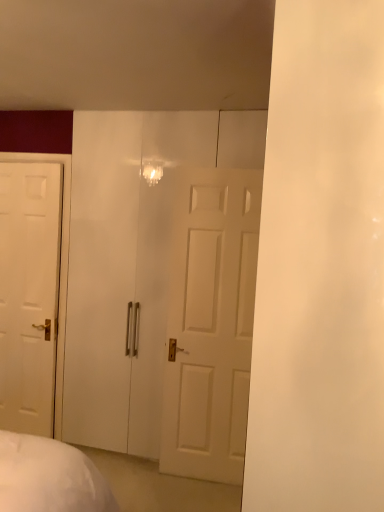
Question: Is transparent glass door at center at the back of white glossy door at left?

Choices:
 (A) no
 (B) yes

Answer: (A)

Question: Is white glossy door at left smaller than transparent glass door at center?

Choices:
 (A) no
 (B) yes

Answer: (B)

Question: Considering the relative sizes of white glossy door at left and transparent glass door at center in the image provided, is white glossy door at left taller than transparent glass door at center?

Choices:
 (A) yes
 (B) no

Answer: (B)

Question: Is white glossy door at left positioned before transparent glass door at center?

Choices:
 (A) yes
 (B) no

Answer: (B)

Question: From the image's perspective, is white glossy door at left over transparent glass door at center?

Choices:
 (A) no
 (B) yes

Answer: (A)

Question: Does white glossy door at left have a larger size compared to transparent glass door at center?

Choices:
 (A) yes
 (B) no

Answer: (B)

Question: Does transparent glass door at center have a lesser height compared to white glossy door at left?

Choices:
 (A) no
 (B) yes

Answer: (A)

Question: Does transparent glass door at center have a greater height compared to white glossy door at left?

Choices:
 (A) yes
 (B) no

Answer: (A)

Question: From a real-world perspective, is transparent glass door at center positioned over white glossy door at left based on gravity?

Choices:
 (A) yes
 (B) no

Answer: (A)

Question: Is white glossy door at left completely or partially inside transparent glass door at center?

Choices:
 (A) yes
 (B) no

Answer: (B)

Question: Can you confirm if transparent glass door at center is wider than white glossy door at left?

Choices:
 (A) yes
 (B) no

Answer: (B)

Question: Is transparent glass door at center located outside white glossy door at left?

Choices:
 (A) yes
 (B) no

Answer: (A)

Question: Considering the positions of white glossy door at left and transparent glass door at center in the image, is white glossy door at left taller or shorter than transparent glass door at center?

Choices:
 (A) tall
 (B) short

Answer: (B)